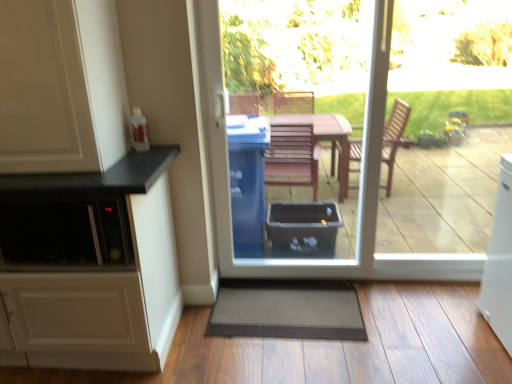
Identify the location of vacant space in gray textured mat at lower center (from a real-world perspective). The image size is (512, 384). (275, 314).